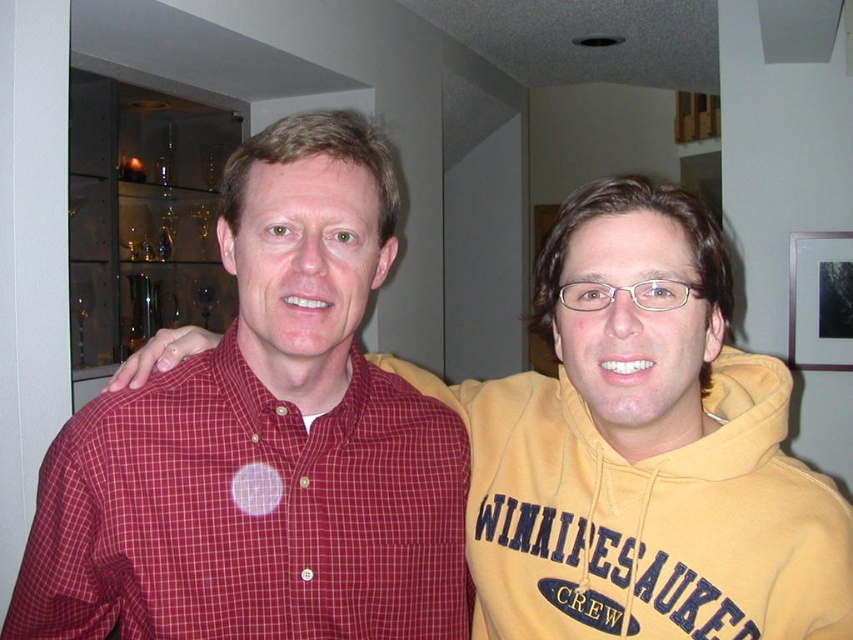
Can you confirm if matte red shirt at left is smaller than checkered cotton shirt at center?

No, matte red shirt at left is not smaller than checkered cotton shirt at center.

Which is behind, point (592, 580) or point (183, 593)?

The point (592, 580) is more distant.

Between point (508, 406) and point (250, 394), which one is positioned behind?

Point (508, 406)

Identify the location of matte red shirt at left. (643, 451).